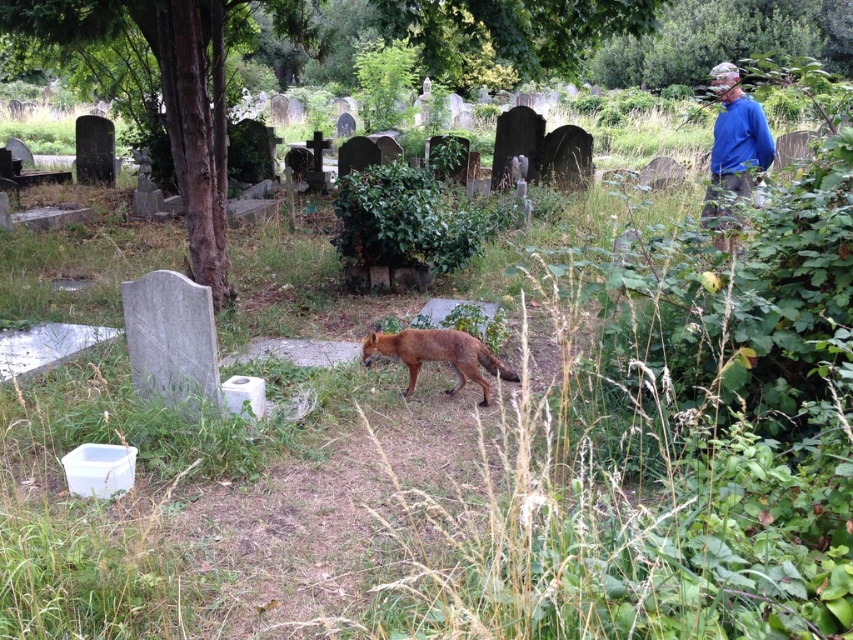
Question: Which object appears closest to the camera in this image?

Choices:
 (A) blue fleece jacket at upper right
 (B) brown fur fox at center

Answer: (A)

Question: Which point is farther from the camera taking this photo?

Choices:
 (A) (645, 12)
 (B) (376, 346)

Answer: (A)

Question: From the image, what is the correct spatial relationship of green leafy tree at center in relation to blue fleece jacket at upper right?

Choices:
 (A) below
 (B) above

Answer: (A)

Question: Is blue fleece jacket at upper right below brown fur fox at center?

Choices:
 (A) yes
 (B) no

Answer: (B)

Question: Which object appears closest to the camera in this image?

Choices:
 (A) brown fur fox at center
 (B) green leafy tree at center
 (C) blue fleece jacket at upper right

Answer: (C)

Question: Is green leafy tree at center further to camera compared to brown fur fox at center?

Choices:
 (A) no
 (B) yes

Answer: (B)